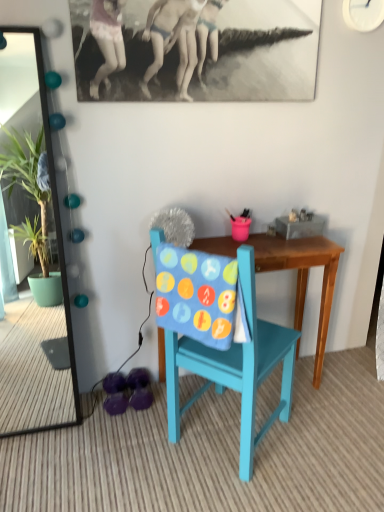
You are a GUI agent. You are given a task and a screenshot of the screen. Output one action in this format:
    pyautogui.click(x=<x>, y=<y>)
    Task: Click on the vacant space underneath teal painted wood chair at center (from a real-world perspective)
    This screenshot has width=384, height=512.
    Given the screenshot: What is the action you would take?
    pyautogui.click(x=215, y=438)